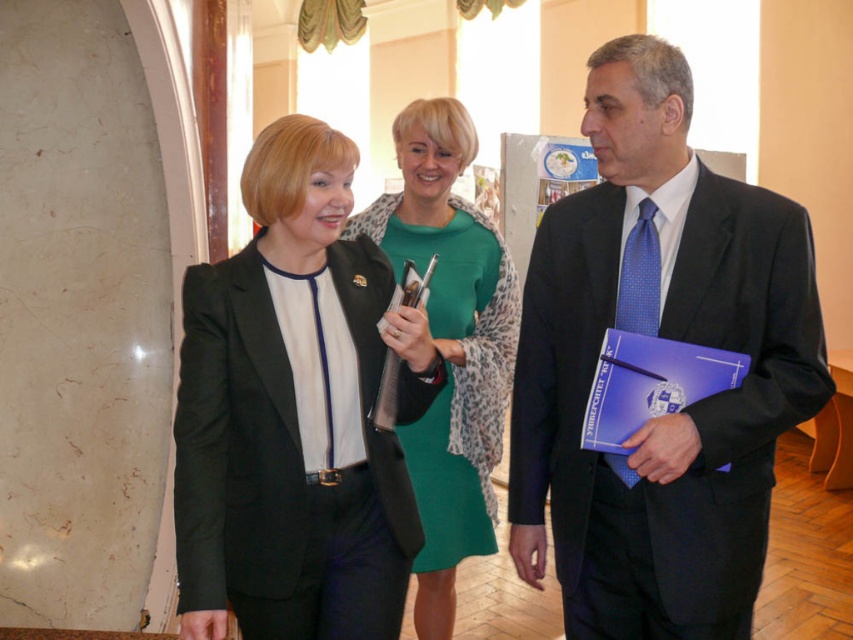
Who is shorter, matte black blazer at center or green matte dress at center?

Standing shorter between the two is matte black blazer at center.

Can you confirm if matte black blazer at center is positioned to the right of green matte dress at center?

In fact, matte black blazer at center is to the left of green matte dress at center.

Is point (344, 209) in front of point (421, 184)?

Yes, point (344, 209) is closer to viewer.

Identify the location of matte black blazer at center. The image size is (853, 640). (294, 412).

Does matte black suit at center come in front of matte black blazer at center?

No, matte black suit at center is further to the viewer.

Which of these two, matte black suit at center or matte black blazer at center, stands taller?

With more height is matte black suit at center.

Is point (636, 627) more distant than point (213, 513)?

Yes, point (636, 627) is behind point (213, 513).

This screenshot has width=853, height=640. In order to click on matte black suit at center in this screenshot , I will do `click(666, 339)`.

Is matte black suit at center below green matte dress at center?

Actually, matte black suit at center is above green matte dress at center.

From the picture: Who is higher up, matte black suit at center or green matte dress at center?

matte black suit at center is above.

In the scene shown: Measure the distance between matte black suit at center and camera.

They are 1.99 meters apart.

Locate an element on the screen. This screenshot has width=853, height=640. matte black suit at center is located at coordinates (666, 339).